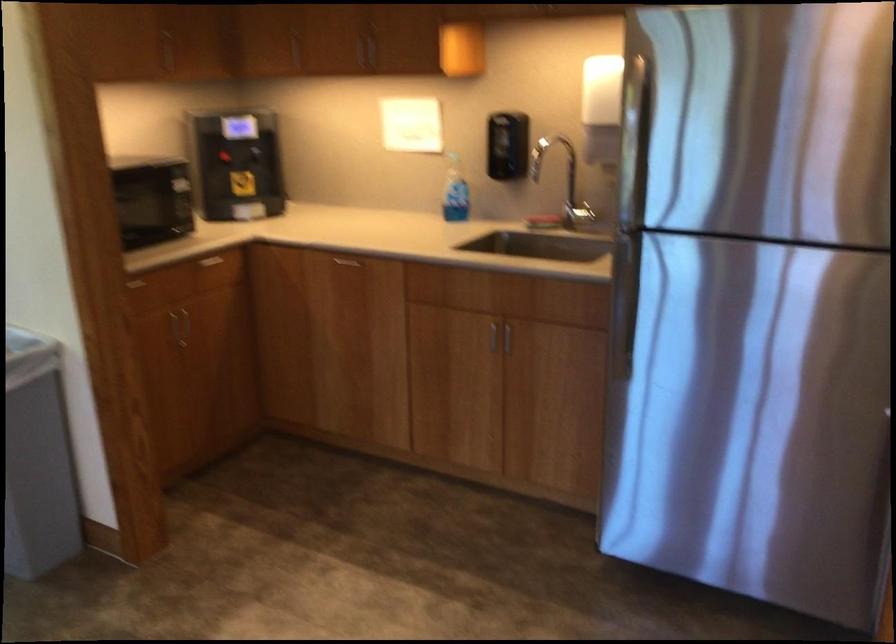
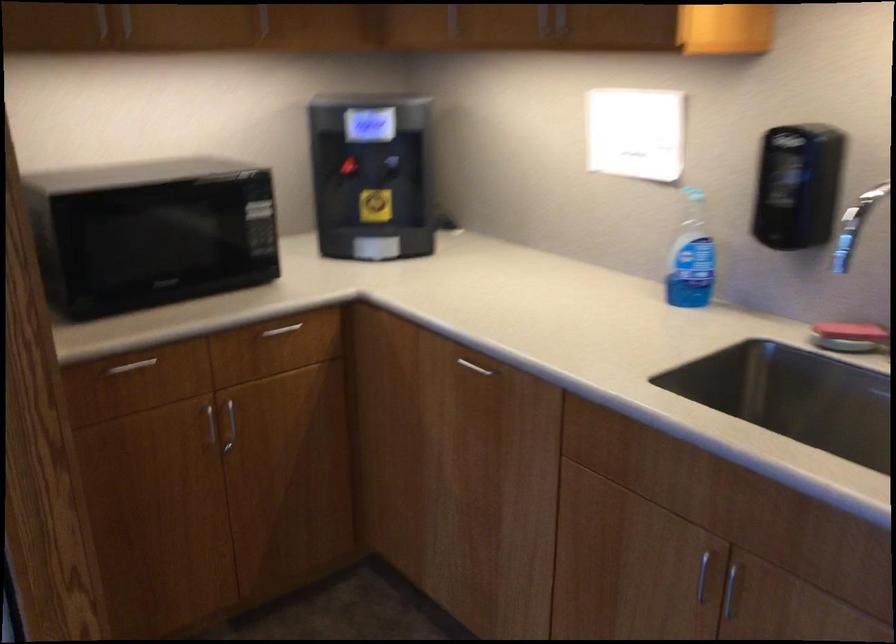
Locate, in the second image, the point that corresponds to pixel 506 342 in the first image.

(729, 590)